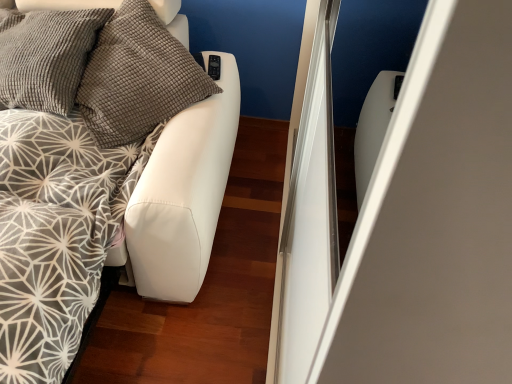
What do you see at coordinates (92, 192) in the screenshot?
I see `white leather bed at left` at bounding box center [92, 192].

The image size is (512, 384). I want to click on white leather bed at left, so click(92, 192).

What do you see at coordinates (137, 77) in the screenshot? I see `textured gray pillow at upper left` at bounding box center [137, 77].

The width and height of the screenshot is (512, 384). Identify the location of textured gray pillow at upper left. (137, 77).

Locate an element on the screen. Image resolution: width=512 pixels, height=384 pixels. white leather bed at left is located at coordinates (92, 192).

Based on their positions, is textured gray pillow at upper left located to the left or right of white leather bed at left?

Based on their positions, textured gray pillow at upper left is located to the right of white leather bed at left.

Is the position of textured gray pillow at upper left less distant than that of white leather bed at left?

No, textured gray pillow at upper left is further to the viewer.

Between point (183, 49) and point (68, 187), which one is positioned in front?

The point (68, 187) is more forward.

From the image's perspective, would you say textured gray pillow at upper left is shown under white leather bed at left?

No, from the image's perspective, textured gray pillow at upper left is not below white leather bed at left.

From a real-world perspective, is textured gray pillow at upper left located beneath white leather bed at left?

No, from a real-world perspective, textured gray pillow at upper left is not below white leather bed at left.

In terms of width, does textured gray pillow at upper left look wider or thinner when compared to white leather bed at left?

Considering their sizes, textured gray pillow at upper left looks slimmer than white leather bed at left.

Which of these two, textured gray pillow at upper left or white leather bed at left, stands taller?

Standing taller between the two is white leather bed at left.

Is textured gray pillow at upper left bigger than white leather bed at left?

No, textured gray pillow at upper left is not bigger than white leather bed at left.

Is textured gray pillow at upper left situated inside white leather bed at left or outside?

textured gray pillow at upper left is located inside white leather bed at left.

Is textured gray pillow at upper left touching white leather bed at left?

No, textured gray pillow at upper left is not making contact with white leather bed at left.

Is textured gray pillow at upper left positioned with its back to white leather bed at left?

Yes, textured gray pillow at upper left's orientation is away from white leather bed at left.

What's the angular difference between textured gray pillow at upper left and white leather bed at left's facing directions?

The angle between the facing direction of textured gray pillow at upper left and the facing direction of white leather bed at left is 44.1 degrees.

Measure the distance between textured gray pillow at upper left and white leather bed at left.

6.99 inches.

Where is `pillow positioned vertically above the white leather bed at left (from a real-world perspective)`? pillow positioned vertically above the white leather bed at left (from a real-world perspective) is located at coordinates (137, 77).

Which object is positioned more to the right, white leather bed at left or textured gray pillow at upper left?

Positioned to the right is textured gray pillow at upper left.

Is the depth of white leather bed at left less than that of textured gray pillow at upper left?

Yes, it is in front of textured gray pillow at upper left.

Between point (149, 286) and point (110, 147), which one is positioned behind?

The point (149, 286) is farther from the camera.

From the image's perspective, is white leather bed at left above or below textured gray pillow at upper left?

Based on their image positions, white leather bed at left is located beneath textured gray pillow at upper left.

From a real-world perspective, is white leather bed at left located higher than textured gray pillow at upper left?

Incorrect, from a real-world perspective, white leather bed at left is lower than textured gray pillow at upper left.

Between white leather bed at left and textured gray pillow at upper left, which one has larger width?

Wider between the two is white leather bed at left.

In terms of height, does white leather bed at left look taller or shorter compared to textured gray pillow at upper left?

white leather bed at left is taller than textured gray pillow at upper left.

Consider the image. Between white leather bed at left and textured gray pillow at upper left, which one has larger size?

Bigger between the two is white leather bed at left.

Is white leather bed at left not within textured gray pillow at upper left?

white leather bed at left is positioned outside textured gray pillow at upper left.

Are white leather bed at left and textured gray pillow at upper left located far from each other?

No, there isn't a large distance between white leather bed at left and textured gray pillow at upper left.

Based on the photo, does white leather bed at left turn towards textured gray pillow at upper left?

No.

Find the location of a particular element. furniture below the textured gray pillow at upper left (from a real-world perspective) is located at coordinates (x=92, y=192).

Identify the location of pillow above the white leather bed at left (from the image's perspective). (137, 77).

Identify the location of pillow on the right side of white leather bed at left. (137, 77).